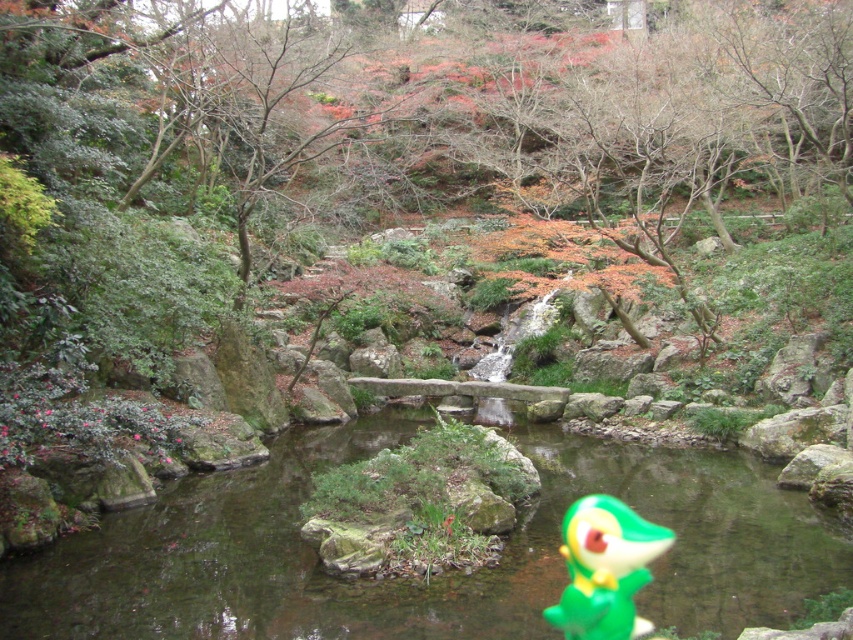
Is transparent plastic stream at center behind green matte toy at center?

Yes, transparent plastic stream at center is behind green matte toy at center.

Can you confirm if transparent plastic stream at center is positioned to the right of green matte toy at center?

Incorrect, transparent plastic stream at center is not on the right side of green matte toy at center.

You are a GUI agent. You are given a task and a screenshot of the screen. Output one action in this format:
    pyautogui.click(x=<x>, y=<y>)
    Task: Click on the transparent plastic stream at center
    
    Given the screenshot: What is the action you would take?
    pyautogui.click(x=432, y=577)